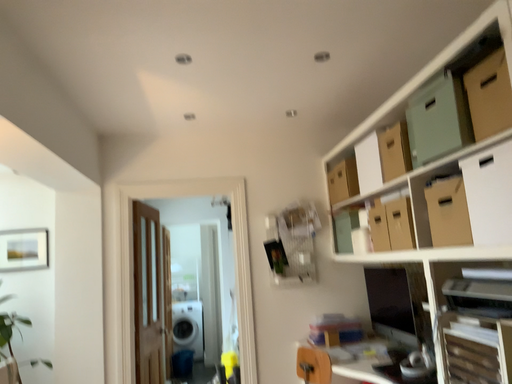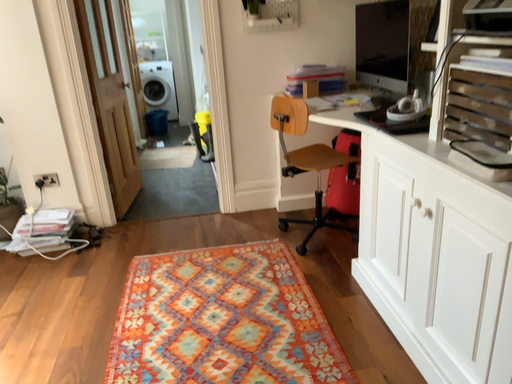
Question: How did the camera likely rotate when shooting the video?

Choices:
 (A) rotated upward
 (B) rotated downward

Answer: (B)